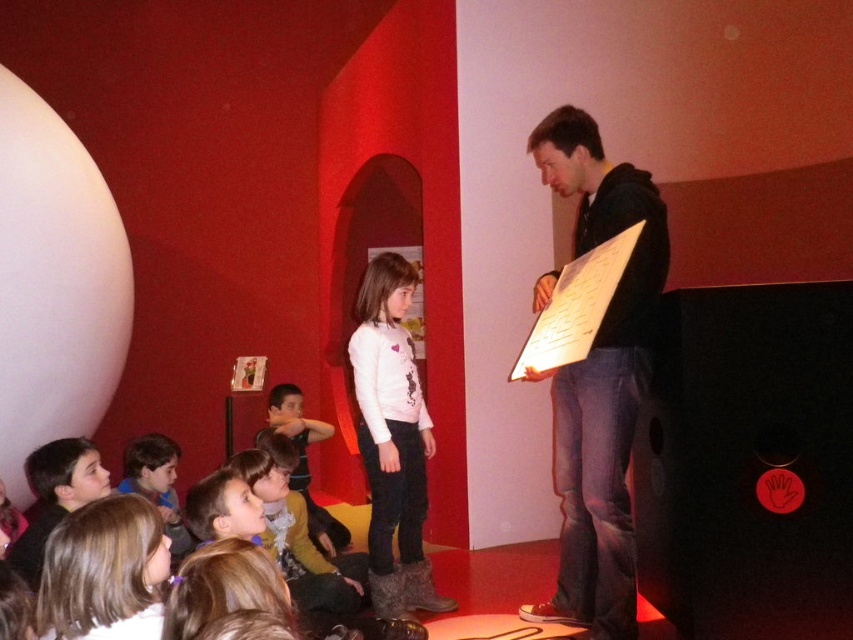
Question: Can you confirm if smooth white shirt at lower left is wider than smooth blue shirt at lower left?

Choices:
 (A) no
 (B) yes

Answer: (A)

Question: Which is nearer to the black matte speaker at center?

Choices:
 (A) smooth white shirt at lower left
 (B) matte brown jacket at center
 (C) smooth blue shirt at lower left

Answer: (A)

Question: Does black hoodie at upper right appear on the left side of pink fleece sweater at center?

Choices:
 (A) no
 (B) yes

Answer: (A)

Question: Among these points, which one is nearest to the camera?

Choices:
 (A) (630, 436)
 (B) (141, 536)

Answer: (B)

Question: Can you confirm if black matte speaker at center is smaller than smooth white shirt at lower left?

Choices:
 (A) no
 (B) yes

Answer: (A)

Question: Estimate the real-world distances between objects in this image. Which object is closer to the smooth white shirt at lower left?

Choices:
 (A) matte brown jacket at center
 (B) black matte speaker at center
 (C) black hoodie at upper right
 (D) pink fleece sweater at center

Answer: (C)